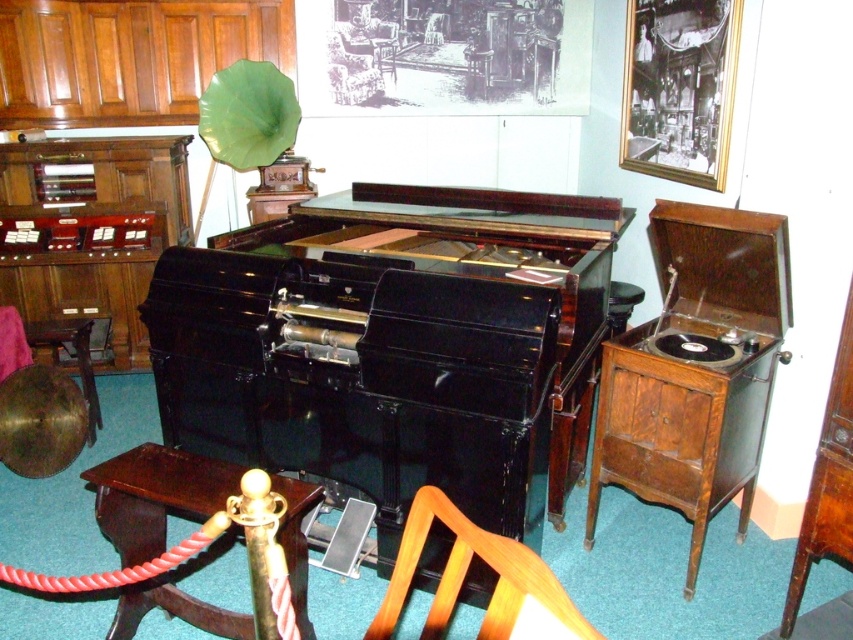
Is wooden chair at lower center to the right of brown wood drawer at lower right from the viewer's perspective?

In fact, wooden chair at lower center is to the left of brown wood drawer at lower right.

Between wooden chair at lower center and brown wood drawer at lower right, which one is positioned lower?

brown wood drawer at lower right

Where is `wooden chair at lower center`? The image size is (853, 640). wooden chair at lower center is located at coordinates (463, 577).

I want to click on wooden chair at lower center, so click(463, 577).

Can you confirm if glossy black piano at center is thinner than brown polished wood table at lower left?

No.

Is point (473, 570) farther from camera compared to point (212, 611)?

Yes, it is.

Is point (376, 531) closer to camera compared to point (157, 452)?

That is False.

Identify the location of glossy black piano at center. (395, 346).

Consider the image. Is wooden chair at lower center further to the viewer compared to wooden drawer at lower right?

No.

Can you confirm if wooden chair at lower center is taller than wooden drawer at lower right?

No, wooden chair at lower center is not taller than wooden drawer at lower right.

Is point (555, 586) farther from viewer compared to point (648, 392)?

No, (555, 586) is in front of (648, 392).

Find the location of a particular element. wooden chair at lower center is located at coordinates (463, 577).